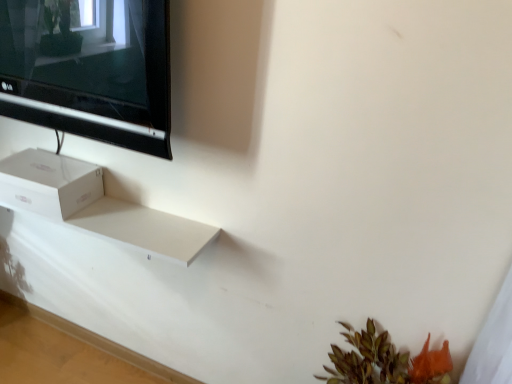
Question: Can you confirm if white cardboard box at lower left is positioned to the right of black glossy tv at upper left?

Choices:
 (A) yes
 (B) no

Answer: (B)

Question: Is white cardboard box at lower left next to black glossy tv at upper left?

Choices:
 (A) yes
 (B) no

Answer: (B)

Question: Is the depth of white cardboard box at lower left greater than that of black glossy tv at upper left?

Choices:
 (A) yes
 (B) no

Answer: (A)

Question: From the image's perspective, is white cardboard box at lower left below black glossy tv at upper left?

Choices:
 (A) no
 (B) yes

Answer: (B)

Question: From the image's perspective, is white cardboard box at lower left on top of black glossy tv at upper left?

Choices:
 (A) yes
 (B) no

Answer: (B)

Question: Considering the relative sizes of white cardboard box at lower left and black glossy tv at upper left in the image provided, is white cardboard box at lower left smaller than black glossy tv at upper left?

Choices:
 (A) yes
 (B) no

Answer: (A)

Question: Does black glossy tv at upper left have a larger size compared to white cardboard box at lower left?

Choices:
 (A) no
 (B) yes

Answer: (B)

Question: Considering the relative positions of black glossy tv at upper left and white cardboard box at lower left in the image provided, is black glossy tv at upper left to the left of white cardboard box at lower left from the viewer's perspective?

Choices:
 (A) no
 (B) yes

Answer: (A)

Question: Does black glossy tv at upper left lie behind white cardboard box at lower left?

Choices:
 (A) yes
 (B) no

Answer: (B)

Question: Is black glossy tv at upper left oriented away from white cardboard box at lower left?

Choices:
 (A) yes
 (B) no

Answer: (B)

Question: From a real-world perspective, does black glossy tv at upper left stand above white cardboard box at lower left?

Choices:
 (A) yes
 (B) no

Answer: (A)

Question: From a real-world perspective, is black glossy tv at upper left positioned under white cardboard box at lower left based on gravity?

Choices:
 (A) no
 (B) yes

Answer: (A)

Question: In terms of height, does black glossy tv at upper left look taller or shorter compared to white cardboard box at lower left?

Choices:
 (A) short
 (B) tall

Answer: (A)